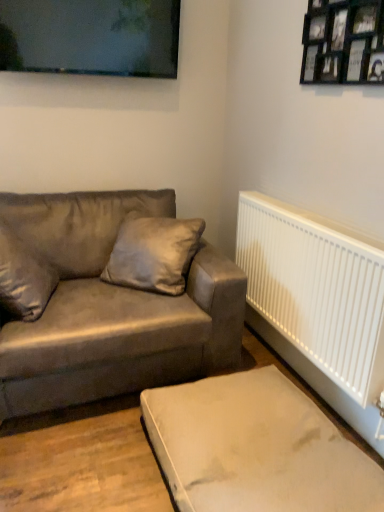
Question: Do you think matte black picture frame at upper center, the 1th picture frame when ordered from left to right, is within beige fabric ottoman at lower right, or outside of it?

Choices:
 (A) inside
 (B) outside

Answer: (B)

Question: In terms of size, does matte black picture frame at upper center, the 1th picture frame when ordered from left to right, appear bigger or smaller than beige fabric ottoman at lower right?

Choices:
 (A) small
 (B) big

Answer: (A)

Question: Which object is positioned closest to the beige fabric ottoman at lower right?

Choices:
 (A) suede-like brown couch at left
 (B) suede-like beige pillow at center
 (C) matte black picture frame at upper center, the 1th picture frame when ordered from left to right
 (D) black wooden picture frame at upper right, which appears as the 1th picture frame when viewed from the front

Answer: (A)

Question: Based on their relative distances, which object is nearer to the black wooden picture frame at upper right, which ranks as the 1th picture frame in right-to-left order?

Choices:
 (A) beige fabric ottoman at lower right
 (B) suede-like brown couch at left
 (C) suede-like beige pillow at center
 (D) matte black picture frame at upper center, the 1th picture frame when ordered from left to right

Answer: (D)